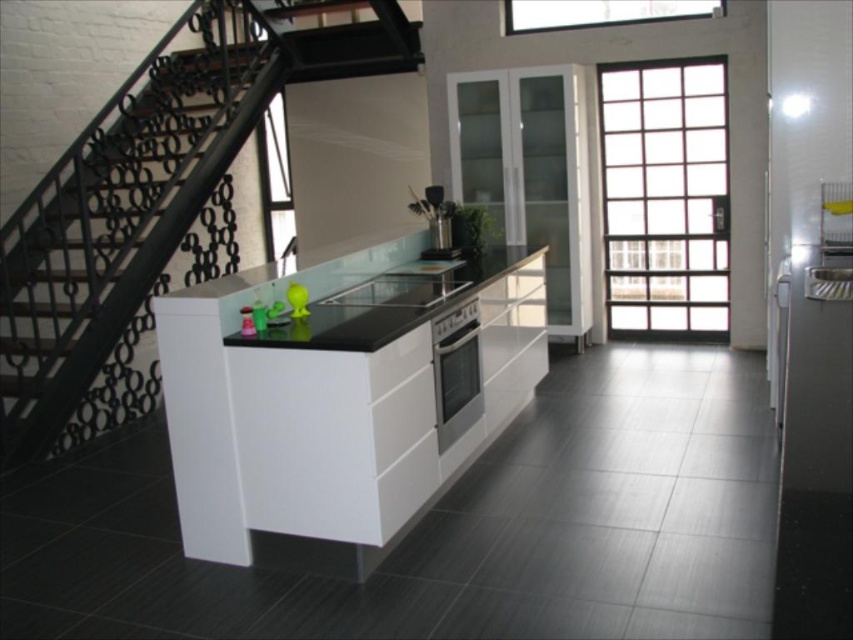
You are a chef preparing to place a large cutting board on the counter. Given that the black glossy counter top at center is larger than the black matte exhaust hood at upper center, will there be enough space for the board?

The black glossy counter top at center has a larger size compared to the black matte exhaust hood at upper center, so there should be sufficient space to place the large cutting board on the counter.

You are a chef preparing a dish and need to place a tall bowl on the counter. The bowl is 15 cm in height. Can the black glossy counter top at center support the bowl without it touching the metallic silver utensil holder at center?

The black glossy counter top at center is taller than the metallic silver utensil holder at center. Since the bowl is 15 cm tall, it can be placed on the counter without touching the utensil holder as there is sufficient vertical space between them.